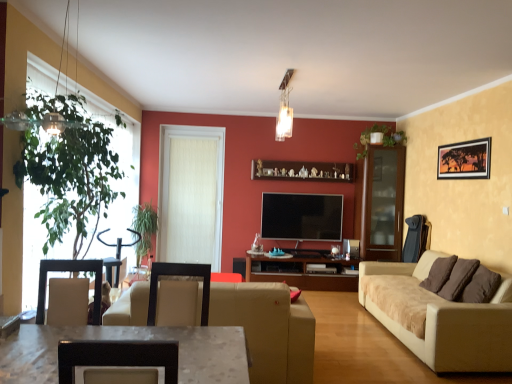
Question: Is beige suede sofa at right, the 2th studio couch from the left, positioned behind green leafy plant at upper center, arranged as the 1th plant when viewed from the top?

Choices:
 (A) no
 (B) yes

Answer: (A)

Question: Would you consider beige suede sofa at right, placed as the first studio couch when sorted from right to left, to be distant from green leafy plant at upper center, positioned as the first plant in right-to-left order?

Choices:
 (A) no
 (B) yes

Answer: (B)

Question: From a real-world perspective, does beige suede sofa at right, the 2th studio couch from the left, stand above green leafy plant at upper center, positioned as the first plant in right-to-left order?

Choices:
 (A) yes
 (B) no

Answer: (B)

Question: Is beige suede sofa at right, the 2th studio couch from the left, thinner than green leafy plant at upper center, positioned as the second plant in bottom-to-top order?

Choices:
 (A) yes
 (B) no

Answer: (B)

Question: From the image's perspective, does beige suede sofa at right, placed as the first studio couch when sorted from right to left, appear higher than green leafy plant at upper center, positioned as the second plant in bottom-to-top order?

Choices:
 (A) yes
 (B) no

Answer: (B)

Question: From a real-world perspective, is white textured door at center above or below silk matte picture frame at upper right?

Choices:
 (A) below
 (B) above

Answer: (A)

Question: Considering the relative positions of white textured door at center and silk matte picture frame at upper right in the image provided, is white textured door at center to the left or to the right of silk matte picture frame at upper right?

Choices:
 (A) right
 (B) left

Answer: (B)

Question: Considering the positions of white textured door at center and silk matte picture frame at upper right in the image, is white textured door at center wider or thinner than silk matte picture frame at upper right?

Choices:
 (A) wide
 (B) thin

Answer: (A)

Question: From their relative heights in the image, would you say white textured door at center is taller or shorter than silk matte picture frame at upper right?

Choices:
 (A) tall
 (B) short

Answer: (A)

Question: Considering the positions of green leafy plant at left and transparent glass cabinet at right in the image, is green leafy plant at left taller or shorter than transparent glass cabinet at right?

Choices:
 (A) short
 (B) tall

Answer: (A)

Question: From the image's perspective, is green leafy plant at left above or below transparent glass cabinet at right?

Choices:
 (A) above
 (B) below

Answer: (A)

Question: Considering the positions of green leafy plant at left and transparent glass cabinet at right in the image, is green leafy plant at left wider or thinner than transparent glass cabinet at right?

Choices:
 (A) wide
 (B) thin

Answer: (A)

Question: From a real-world perspective, is green leafy plant at left physically located above or below transparent glass cabinet at right?

Choices:
 (A) below
 (B) above

Answer: (B)

Question: From a real-world perspective, is beige leather couch at center, the second studio couch positioned from the right, physically located above or below white marble table at lower left?

Choices:
 (A) below
 (B) above

Answer: (A)

Question: In the image, is beige leather couch at center, marked as the first studio couch in a left-to-right arrangement, on the left side or the right side of white marble table at lower left?

Choices:
 (A) left
 (B) right

Answer: (B)